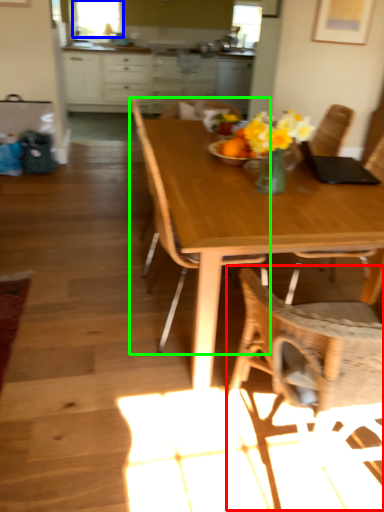
Question: Which object is positioned closest to chair (highlighted by a red box)? Select from window screen (highlighted by a blue box) and chair (highlighted by a green box).

Choices:
 (A) window screen
 (B) chair

Answer: (B)